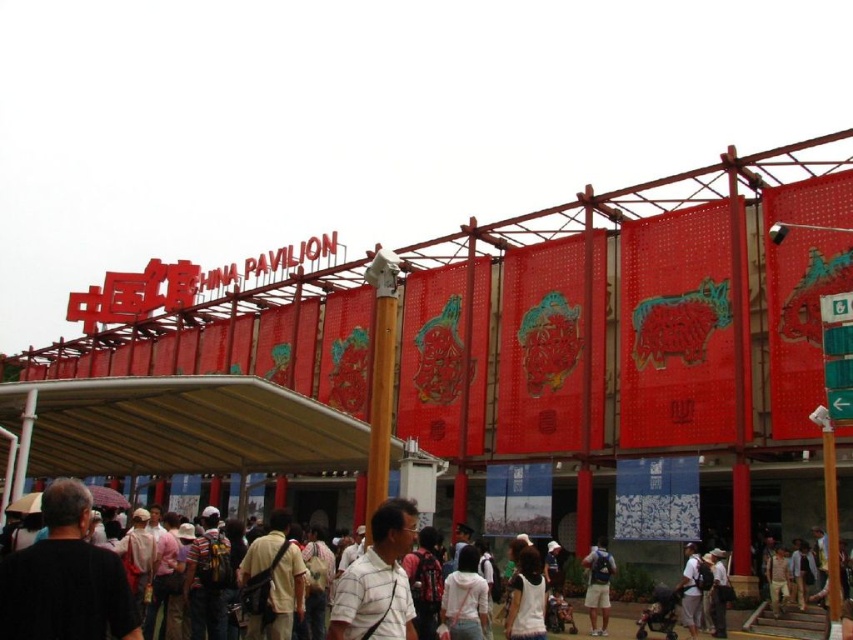
You are standing at the entrance of the China Pavilion and want to locate two specific points marked on the facade. The first point is at coordinates point (386,612) and the second is at point (595,628). From your perspective, which point appears closer to you?

Point (386,612) is in front of point (595,628), so it appears closer to you.